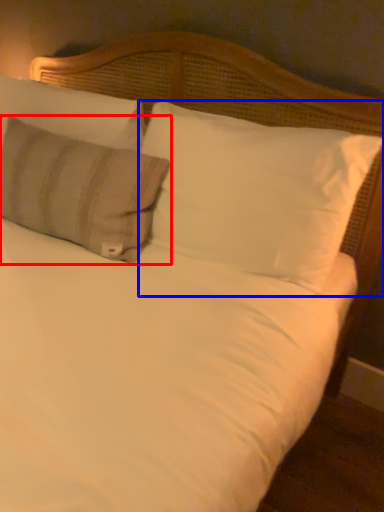
Question: Which point is further to the camera, pillow (highlighted by a red box) or pillow (highlighted by a blue box)?

Choices:
 (A) pillow
 (B) pillow

Answer: (A)